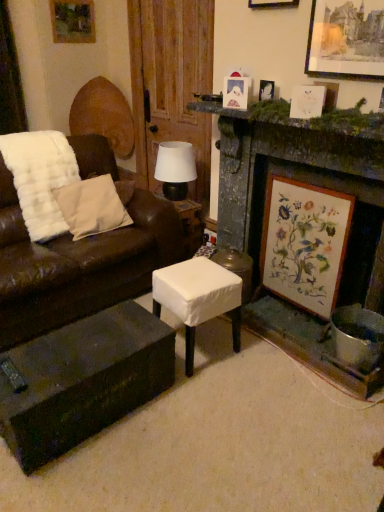
Locate an element on the screen. The width and height of the screenshot is (384, 512). unoccupied area in front of white fabric-covered stool at center is located at coordinates (209, 396).